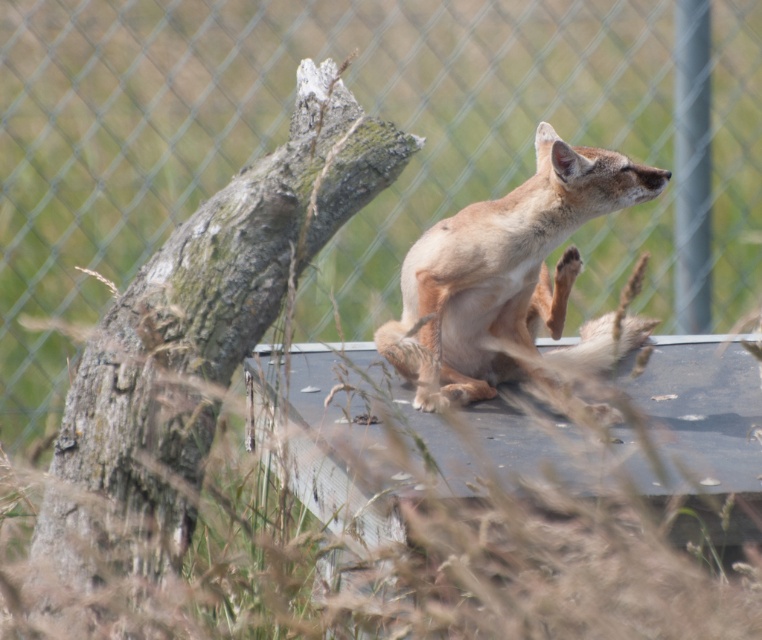
You are standing in front of the image and want to touch the two points mentioned. Which point, point (66, 577) or point (437, 378), is closer to your hand?

Point (66, 577) is closer to the viewer than point (437, 378), so it is closer to your hand.